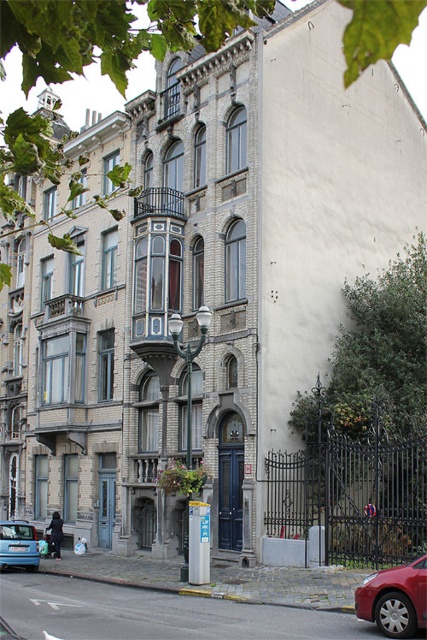
You are a delivery person approaching the building and need to park your vehicle. You see a shiny red car at lower right and a blue matte hatchback at lower left. Which vehicle is blocking the entrance to the property?

The shiny red car at lower right is blocking the entrance to the property because it is positioned in front of the blue matte hatchback at lower left, which suggests it is closer to the entrance.

You are a delivery person trying to park your van between the shiny red car at lower right and the blue matte hatchback at lower left. Can your van fit in the space between them?

The shiny red car at lower right is thinner than the blue matte hatchback at lower left, so the space between them may be narrow. However, without knowing the exact width of your van, it is impossible to determine if it will fit.